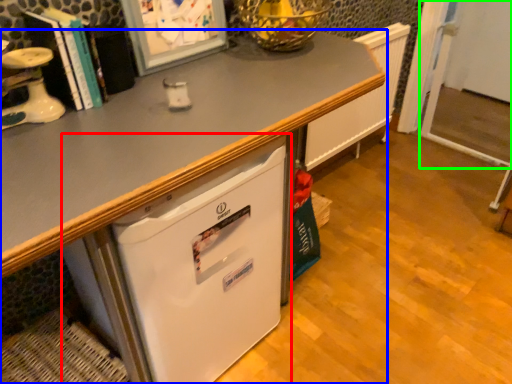
Question: Which object is positioned farthest from refrigerator (highlighted by a red box)? Select from desk (highlighted by a blue box) and screen door (highlighted by a green box).

Choices:
 (A) desk
 (B) screen door

Answer: (B)